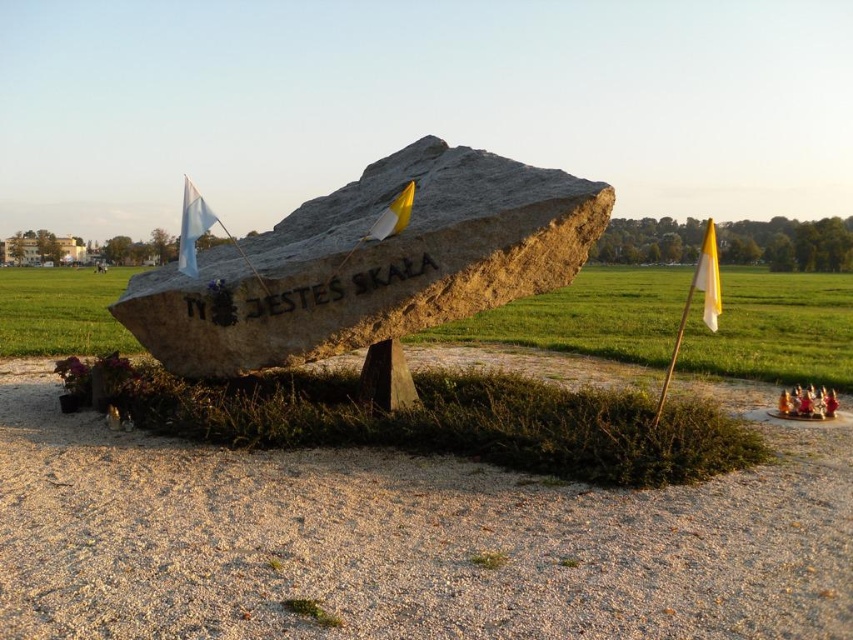
Is gray stone boulder at center to the right of natural stone rock at center from the viewer's perspective?

Correct, you'll find gray stone boulder at center to the right of natural stone rock at center.

Image resolution: width=853 pixels, height=640 pixels. In order to click on gray stone boulder at center in this screenshot , I will do `click(370, 262)`.

Image resolution: width=853 pixels, height=640 pixels. I want to click on dirt gravel at center, so click(402, 540).

Where is `dirt gravel at center`? dirt gravel at center is located at coordinates (402, 540).

Does dirt gravel at center have a lesser height compared to gray stone boulder at center?

Yes.

Between dirt gravel at center and gray stone boulder at center, which one is positioned higher?

gray stone boulder at center is above.

In order to click on dirt gravel at center in this screenshot , I will do `click(402, 540)`.